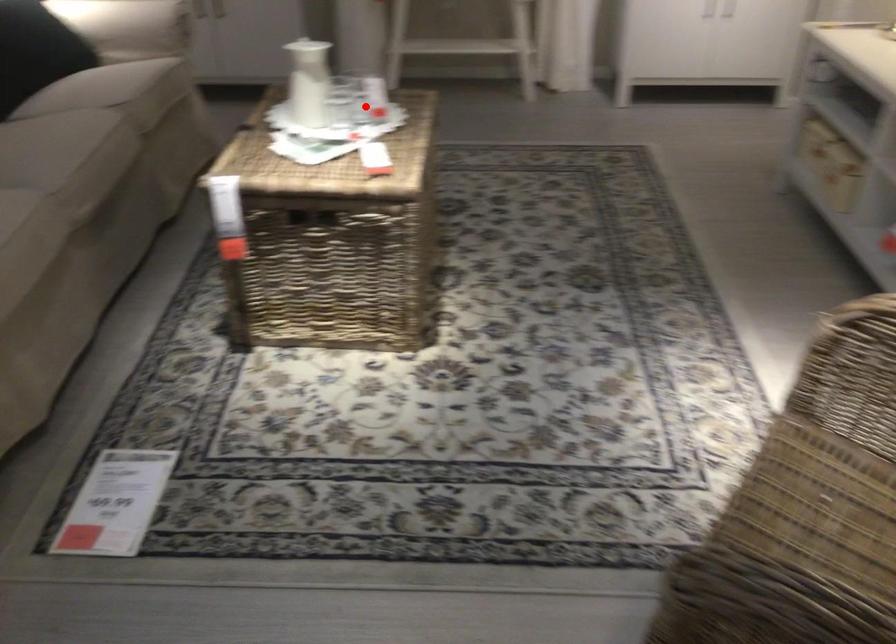
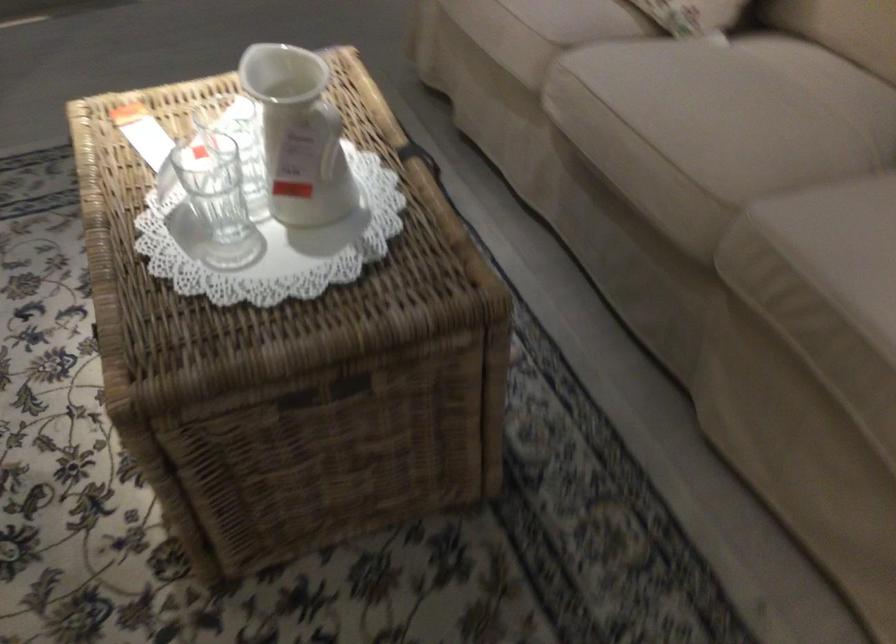
The point at the highlighted location is marked in the first image. Where is the corresponding point in the second image?

(212, 205)